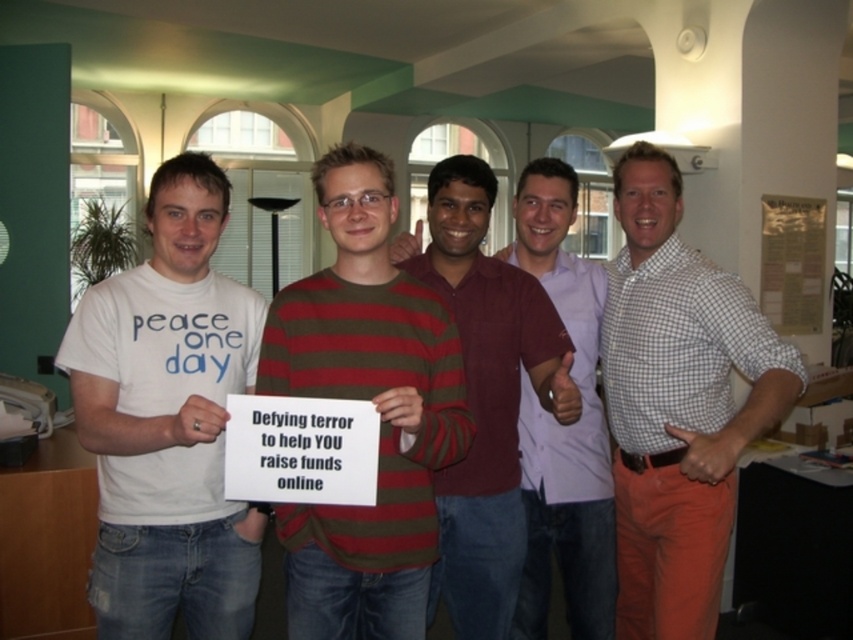
Is striped cotton shirt at center in front of white checkered shirt at center?

Yes, striped cotton shirt at center is in front of white checkered shirt at center.

Does striped cotton shirt at center appear under white checkered shirt at center?

No, striped cotton shirt at center is not below white checkered shirt at center.

Which is behind, point (338, 524) or point (753, 420)?

The point (753, 420) is more distant.

Image resolution: width=853 pixels, height=640 pixels. Find the location of `striped cotton shirt at center`. striped cotton shirt at center is located at coordinates coord(375,406).

Is white t-shirt at left behind maroon striped sweater at center?

No.

Between white t-shirt at left and maroon striped sweater at center, which one appears on the left side from the viewer's perspective?

white t-shirt at left is more to the left.

Which is behind, point (93, 365) or point (496, 556)?

Positioned behind is point (496, 556).

Find the location of a particular element. white t-shirt at left is located at coordinates (167, 420).

Does striped cotton shirt at center appear over light pink shirt at center?

Indeed, striped cotton shirt at center is positioned over light pink shirt at center.

Between point (337, 337) and point (590, 456), which one is positioned in front?

Point (337, 337) is more forward.

Where is `striped cotton shirt at center`? striped cotton shirt at center is located at coordinates (375, 406).